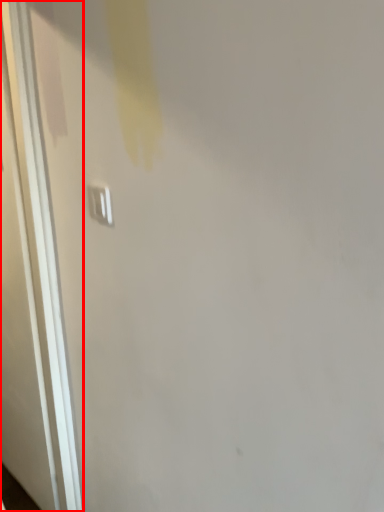
Question: From the image's perspective, where is door (annotated by the red box) located in relation to light switch in the image?

Choices:
 (A) below
 (B) above

Answer: (A)